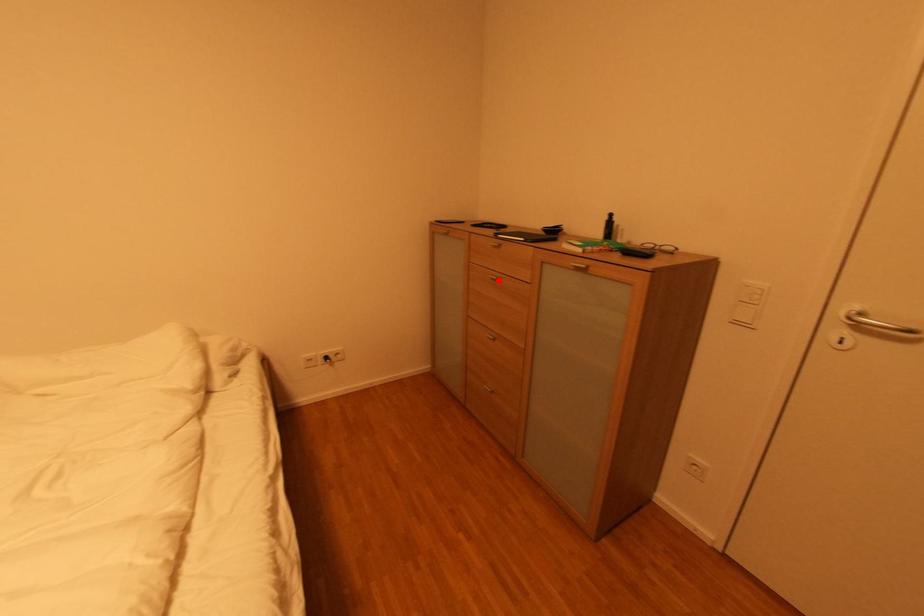
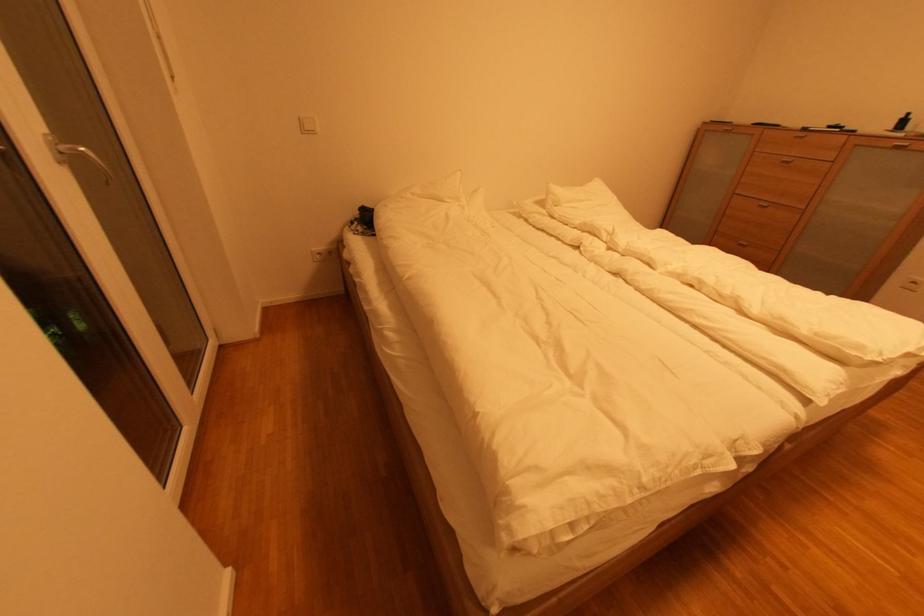
Where in the second image is the point corresponding to the highlighted location from the first image?

(789, 163)